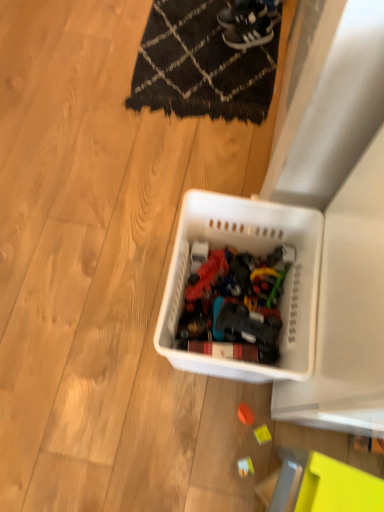
Locate an element on the screen. This screenshot has width=384, height=512. unoccupied space behind white plastic toy at lower center, the third toy in the top-to-bottom sequence is located at coordinates (235, 411).